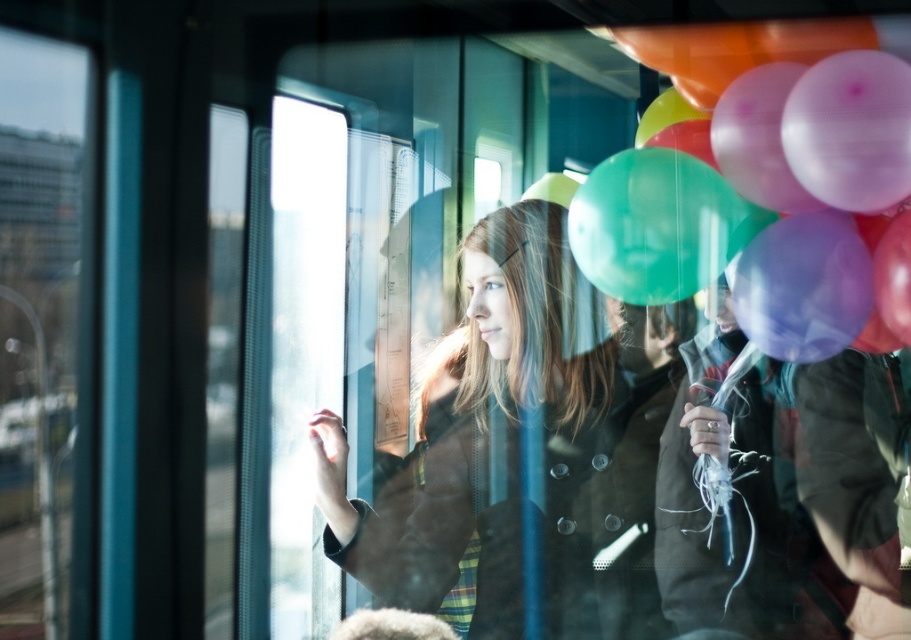
You are a passenger on a tram and you see the matte brown coat at center and the translucent rubber balloons at upper right. Which object is closer to you?

The matte brown coat at center is closer to you because the translucent rubber balloons at upper right are behind it.

You are a passenger on a tram and want to check the weather outside. You notice the matte brown coat at center near the window. Is the coat positioned such that it might block your view of the window?

The matte brown coat at center is located at point (492, 445), which might block your view of the window if you are seated nearby. Check the exact position relative to the window to be sure.

You are a passenger on a tram and want to hand your translucent rubber balloons at upper right to the person wearing the matte brown coat at center. Can you reach them without moving from your seat?

The matte brown coat at center is located below the translucent rubber balloons at upper right, so you can reach them by extending your arm downward from the balloons to the person in the coat.